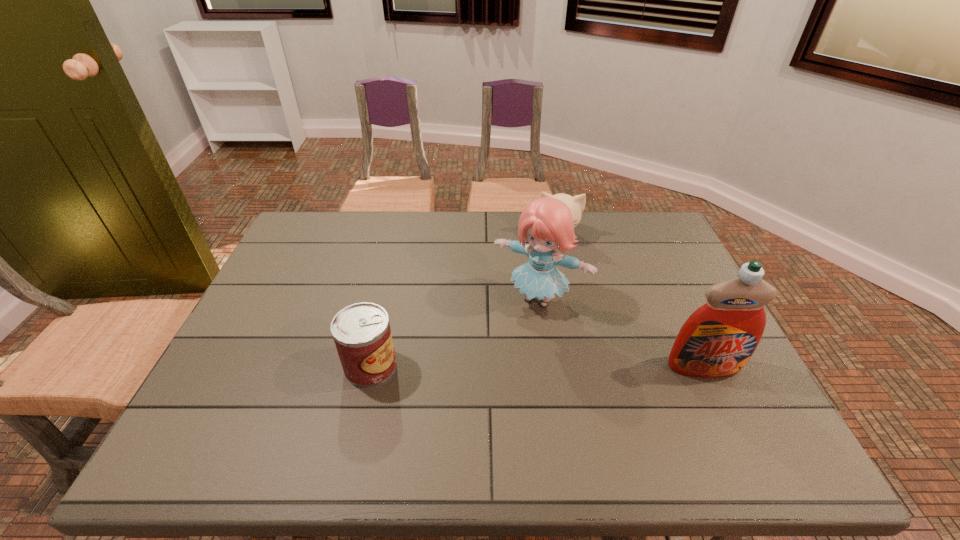
Where is `vacant space in between the leftmost object and the farthest object`? vacant space in between the leftmost object and the farthest object is located at coordinates (465, 301).

The image size is (960, 540). Find the location of `vacant space that's between the second farthest object and the detergent`. vacant space that's between the second farthest object and the detergent is located at coordinates (621, 333).

Find the location of a particular element. Image resolution: width=960 pixels, height=540 pixels. free point between the farthest object and the rightmost object is located at coordinates [631, 301].

The height and width of the screenshot is (540, 960). I want to click on free area in between the can and the rightmost object, so click(x=538, y=366).

Find the location of a particular element. The width and height of the screenshot is (960, 540). free space between the second farthest object and the can is located at coordinates (455, 333).

The width and height of the screenshot is (960, 540). I want to click on free area in between the farthest object and the detergent, so click(631, 301).

Where is `vacant area that lies between the third nearest object and the detergent`? This screenshot has height=540, width=960. vacant area that lies between the third nearest object and the detergent is located at coordinates (621, 333).

Identify the location of the closest object to the doll. 576,204.

The width and height of the screenshot is (960, 540). What are the coordinates of `the third closest object to the can` in the screenshot? It's located at (717, 340).

Where is `free location that satisfies the following two spatial constraints: 1. on the back side of the leftmost object; 2. on the right side of the doll`? The width and height of the screenshot is (960, 540). free location that satisfies the following two spatial constraints: 1. on the back side of the leftmost object; 2. on the right side of the doll is located at coordinates (386, 299).